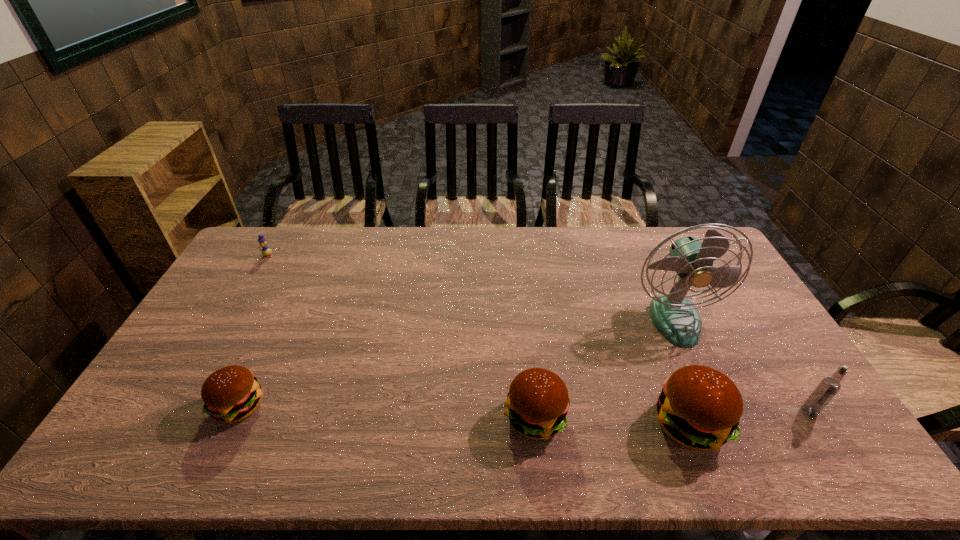
Image resolution: width=960 pixels, height=540 pixels. Identify the location of the second object from left to right. (231, 394).

You are a GUI agent. You are given a task and a screenshot of the screen. Output one action in this format:
    pyautogui.click(x=<x>, y=<y>)
    Task: Click on the shortest hamburger
    
    Given the screenshot: What is the action you would take?
    pyautogui.click(x=231, y=394)

The image size is (960, 540). I want to click on the second shortest hamburger, so click(537, 404).

What are the coordinates of `the second hamburger from right to left` in the screenshot? It's located at (537, 404).

Locate an element on the screen. the rightmost hamburger is located at coordinates (699, 407).

At what (x,y) coordinates should I click in order to perform the action: click on the leftmost object. Please return your answer as a coordinate pair (x, y). This screenshot has width=960, height=540. Looking at the image, I should click on (265, 251).

What are the coordinates of `duckling` in the screenshot? It's located at (265, 251).

Where is `vodka`? vodka is located at coordinates (829, 386).

The height and width of the screenshot is (540, 960). Find the location of `fan`. fan is located at coordinates (676, 318).

At what (x,y) coordinates should I click in order to perform the action: click on the second farthest object. Please return your answer as a coordinate pair (x, y). Looking at the image, I should click on (676, 318).